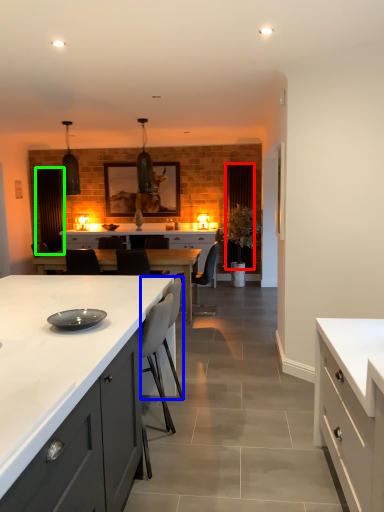
Question: Based on their relative distances, which object is farther from glass door (highlighted by a red box)? Choose from armchair (highlighted by a blue box) and glass door (highlighted by a green box).

Choices:
 (A) armchair
 (B) glass door

Answer: (A)